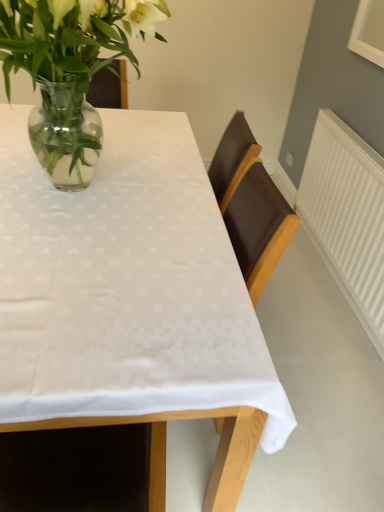
Identify the location of free space in front of clear glass vase at upper left. (105, 266).